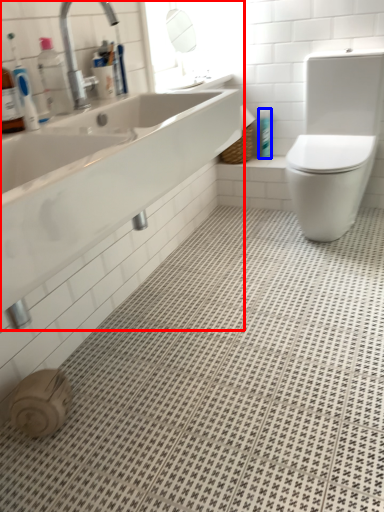
Question: Which point is closer to the camera, sink (highlighted by a red box) or toiletry (highlighted by a blue box)?

Choices:
 (A) sink
 (B) toiletry

Answer: (A)